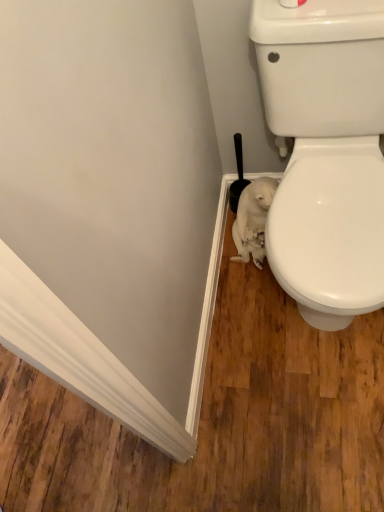
What do you see at coordinates (238, 176) in the screenshot?
I see `black plastic brush at lower right` at bounding box center [238, 176].

The image size is (384, 512). I want to click on black plastic brush at lower right, so click(238, 176).

What is the approximate width of black plastic brush at lower right?

4.26 inches.

In order to face black plastic brush at lower right, should I rotate leftwards or rightwards?

Rotate right and turn 6.166 degrees.

This screenshot has width=384, height=512. What do you see at coordinates (253, 220) in the screenshot?
I see `white fur animal at lower right` at bounding box center [253, 220].

Locate an element on the screen. The image size is (384, 512). white fur animal at lower right is located at coordinates (253, 220).

You are a GUI agent. You are given a task and a screenshot of the screen. Output one action in this format:
    pyautogui.click(x=<x>, y=<y>)
    Task: Click on the black plastic brush at lower right
    This screenshot has height=512, width=384.
    Given the screenshot: What is the action you would take?
    pyautogui.click(x=238, y=176)

Consider the image. Considering the relative positions of white fur animal at lower right and black plastic brush at lower right in the image provided, is white fur animal at lower right to the right of black plastic brush at lower right from the viewer's perspective?

Indeed, white fur animal at lower right is positioned on the right side of black plastic brush at lower right.

Which object is further away from the camera, white fur animal at lower right or black plastic brush at lower right?

black plastic brush at lower right is further from the camera.

Does point (240, 222) lie in front of point (241, 168)?

Yes, it is.

From the image's perspective, which is above, white fur animal at lower right or black plastic brush at lower right?

black plastic brush at lower right, from the image's perspective.

From a real-world perspective, is white fur animal at lower right positioned above or below black plastic brush at lower right?

From a real-world perspective, white fur animal at lower right is physically below black plastic brush at lower right.

Can you confirm if white fur animal at lower right is thinner than black plastic brush at lower right?

No.

Considering the sizes of objects white fur animal at lower right and black plastic brush at lower right in the image provided, who is shorter, white fur animal at lower right or black plastic brush at lower right?

white fur animal at lower right.

In terms of size, does white fur animal at lower right appear bigger or smaller than black plastic brush at lower right?

white fur animal at lower right is bigger than black plastic brush at lower right.

Is white fur animal at lower right inside the boundaries of black plastic brush at lower right, or outside?

white fur animal at lower right exists outside the volume of black plastic brush at lower right.

Is white fur animal at lower right positioned far away from black plastic brush at lower right?

No, white fur animal at lower right is not far away from black plastic brush at lower right.

Is white fur animal at lower right facing towards black plastic brush at lower right?

No, white fur animal at lower right is not turned towards black plastic brush at lower right.

Measure the distance from white fur animal at lower right to black plastic brush at lower right.

A distance of 9.82 centimeters exists between white fur animal at lower right and black plastic brush at lower right.

This screenshot has width=384, height=512. What are the coordinates of `brush above the white fur animal at lower right (from the image's perspective)` in the screenshot? It's located at (238, 176).

Based on their positions, is black plastic brush at lower right located to the left or right of white fur animal at lower right?

black plastic brush at lower right is positioned on white fur animal at lower right's left side.

Is black plastic brush at lower right in front of white fur animal at lower right?

No.

Which is in front, point (243, 179) or point (244, 191)?

The point (244, 191) is more forward.

From the image's perspective, is black plastic brush at lower right located beneath white fur animal at lower right?

No, from the image's perspective, black plastic brush at lower right is not below white fur animal at lower right.

From a real-world perspective, who is located lower, black plastic brush at lower right or white fur animal at lower right?

In real-world perspective, white fur animal at lower right is lower.

Can you confirm if black plastic brush at lower right is thinner than white fur animal at lower right?

Indeed, black plastic brush at lower right has a lesser width compared to white fur animal at lower right.

Can you confirm if black plastic brush at lower right is taller than white fur animal at lower right?

Correct, black plastic brush at lower right is much taller as white fur animal at lower right.

Considering the relative sizes of black plastic brush at lower right and white fur animal at lower right in the image provided, is black plastic brush at lower right smaller than white fur animal at lower right?

Indeed, black plastic brush at lower right has a smaller size compared to white fur animal at lower right.

Can we say black plastic brush at lower right lies outside white fur animal at lower right?

A: black plastic brush at lower right lies outside white fur animal at lower right's area.

Are black plastic brush at lower right and white fur animal at lower right making contact?

Yes, black plastic brush at lower right is beside white fur animal at lower right.

Is black plastic brush at lower right oriented away from white fur animal at lower right?

black plastic brush at lower right does not have its back to white fur animal at lower right.

How different are the orientations of black plastic brush at lower right and white fur animal at lower right in degrees?

0.00371 degrees.

How distant is black plastic brush at lower right from white fur animal at lower right?

9.82 centimeters.

Where is `animal that appears in front of the black plastic brush at lower right`? This screenshot has height=512, width=384. animal that appears in front of the black plastic brush at lower right is located at coordinates (253, 220).

This screenshot has width=384, height=512. I want to click on brush on the left side of white fur animal at lower right, so click(x=238, y=176).

You are a GUI agent. You are given a task and a screenshot of the screen. Output one action in this format:
    pyautogui.click(x=<x>, y=<y>)
    Task: Click on the animal that is below the black plastic brush at lower right (from the image's perspective)
    The image size is (384, 512).
    Given the screenshot: What is the action you would take?
    pyautogui.click(x=253, y=220)